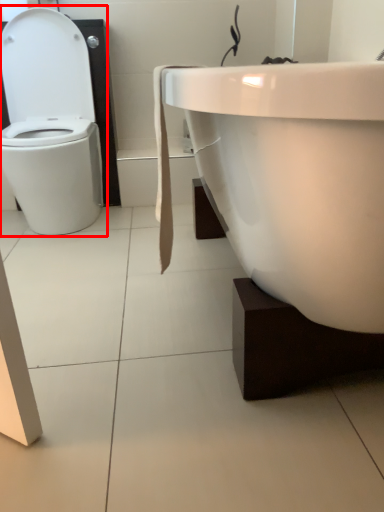
Question: From the image's perspective, where is toilet (annotated by the red box) located in relation to sink in the image?

Choices:
 (A) below
 (B) above

Answer: (B)